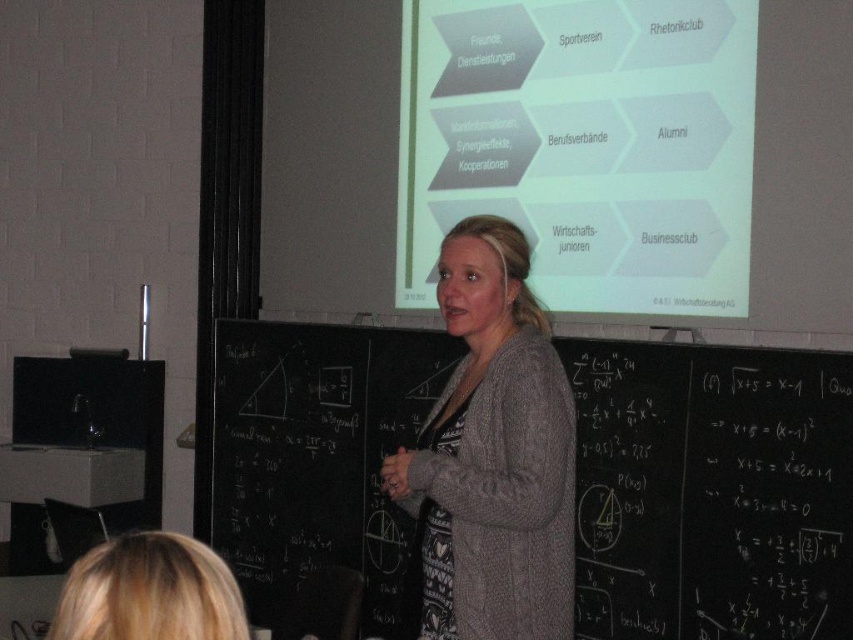
Is black chalkboard at center positioned at the back of green matte projector screen at upper center?

Yes, it is behind green matte projector screen at upper center.

Measure the distance between black chalkboard at center and camera.

black chalkboard at center is 3.48 meters away from camera.

Between point (283, 371) and point (531, 177), which one is positioned in front?

Point (531, 177) is in front.

Find the location of a particular element. This screenshot has height=640, width=853. black chalkboard at center is located at coordinates (711, 490).

Which is in front, point (717, 237) or point (397, 467)?

Point (397, 467) is in front.

Locate an element on the screen. This screenshot has height=640, width=853. green matte projector screen at upper center is located at coordinates (584, 145).

Find the location of a particular element. The height and width of the screenshot is (640, 853). green matte projector screen at upper center is located at coordinates (584, 145).

Can you confirm if green matte projector screen at upper center is positioned below blonde hair at lower left?

Incorrect, green matte projector screen at upper center is not positioned below blonde hair at lower left.

Which is in front, point (718, 164) or point (170, 625)?

Point (170, 625) is more forward.

What are the coordinates of `green matte projector screen at upper center` in the screenshot? It's located at (584, 145).